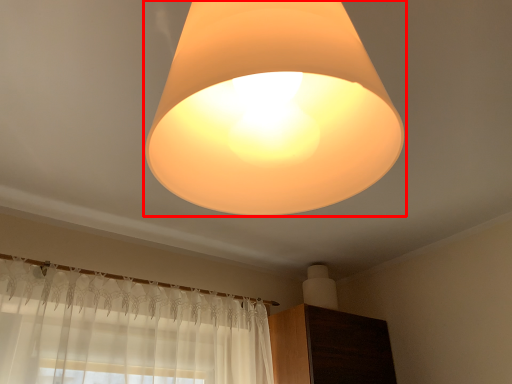
Question: From the image's perspective, where is lamp (annotated by the red box) located relative to dresser?

Choices:
 (A) above
 (B) below

Answer: (A)